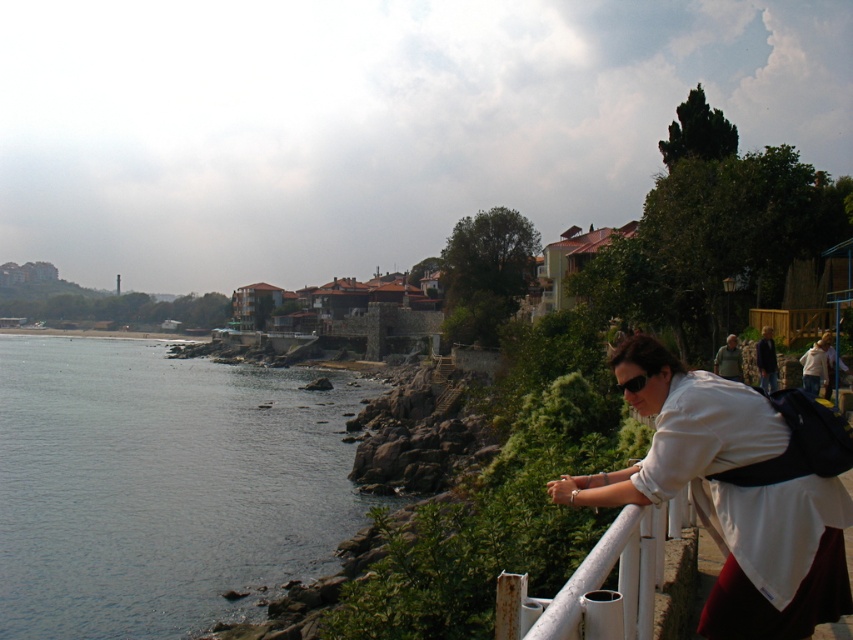
Question: Is dark blue water at lower left positioned before white metallic rail at lower right?

Choices:
 (A) yes
 (B) no

Answer: (B)

Question: Does white matte shirt at upper right appear over white metallic rail at lower right?

Choices:
 (A) no
 (B) yes

Answer: (B)

Question: Which of the following is the farthest from the observer?

Choices:
 (A) white matte shirt at upper right
 (B) dark blue water at lower left

Answer: (B)

Question: Which point is closer to the camera?

Choices:
 (A) (845, 499)
 (B) (36, 408)
 (C) (659, 554)

Answer: (A)

Question: Considering the relative positions of white matte shirt at upper right and white metallic rail at lower right in the image provided, where is white matte shirt at upper right located with respect to white metallic rail at lower right?

Choices:
 (A) left
 (B) right

Answer: (B)

Question: Which point appears farthest from the camera in this image?

Choices:
 (A) (795, 579)
 (B) (531, 634)
 (C) (86, 621)

Answer: (C)